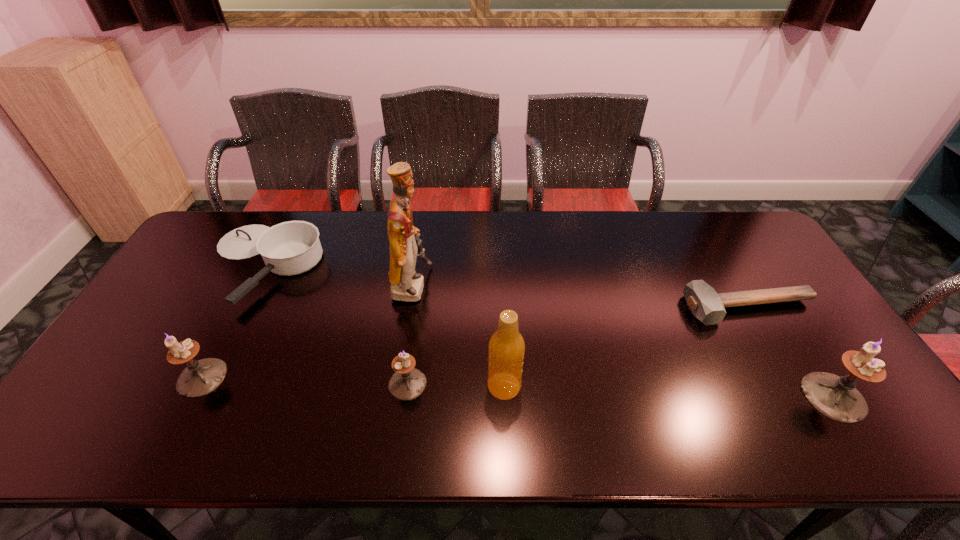
Find the location of a particular element. beer bottle is located at coordinates (506, 349).

Find the location of a particular element. This screenshot has width=960, height=540. vacant space situated 0.050m on the left of the second shortest candle holder is located at coordinates (159, 377).

Where is `vacant space located on the left of the second candle holder from right to left`? This screenshot has height=540, width=960. vacant space located on the left of the second candle holder from right to left is located at coordinates (348, 383).

Where is `free space located 0.300m on the left of the tallest candle holder`? free space located 0.300m on the left of the tallest candle holder is located at coordinates (681, 397).

At what (x,y) coordinates should I click in order to perform the action: click on free space located 0.310m on the front-facing side of the nutcracker. Please return your answer as a coordinate pair (x, y). Looking at the image, I should click on (533, 287).

At what (x,y) coordinates should I click in order to perform the action: click on vacant space located on the front of the saucepan. Please return your answer as a coordinate pair (x, y). Looking at the image, I should click on (220, 348).

Locate an element on the screen. vacant position located 0.240m on the back of the mallet is located at coordinates (710, 242).

In order to click on free region located 0.390m on the back of the beer bottle in this screenshot , I will do `click(499, 267)`.

Find the location of a particular element. object that is at the far edge is located at coordinates (289, 248).

Image resolution: width=960 pixels, height=540 pixels. I want to click on beer bottle located in the near edge section of the desktop, so click(x=506, y=349).